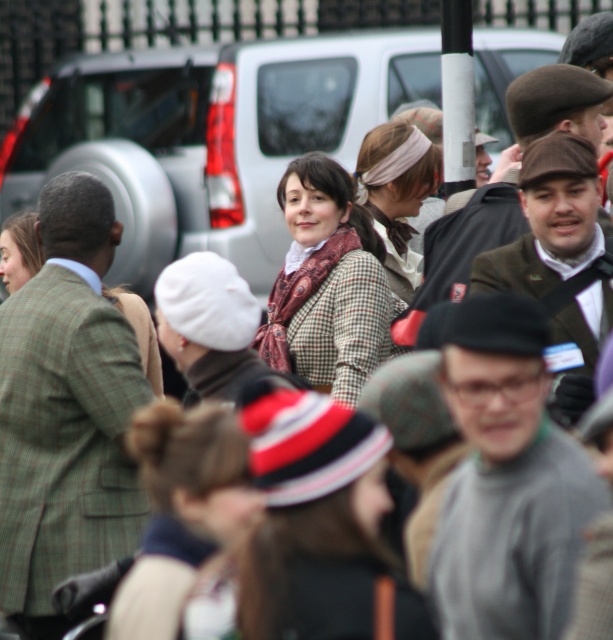
Question: Which is nearer to the matte brown scarf at center?

Choices:
 (A) gray wool sweater at center
 (B) plaid wool coat at center
 (C) matte brown coat at center
 (D) brown woolen cap at center-right

Answer: (B)

Question: Which object appears farthest from the camera in this image?

Choices:
 (A) gray wool sweater at center
 (B) green plaid suit at left
 (C) matte brown coat at center
 (D) plaid wool coat at center

Answer: (C)

Question: Can you confirm if green plaid suit at left is positioned to the left of gray wool sweater at center?

Choices:
 (A) no
 (B) yes

Answer: (B)

Question: In this image, where is brown woolen hat at upper right located relative to matte brown coat at center?

Choices:
 (A) right
 (B) left

Answer: (A)

Question: Which object appears closest to the camera in this image?

Choices:
 (A) brown woolen hat at upper right
 (B) brown woolen cap at center-right
 (C) plaid wool coat at center
 (D) gray wool sweater at center

Answer: (D)

Question: Is matte brown scarf at center smaller than matte brown coat at center?

Choices:
 (A) yes
 (B) no

Answer: (B)